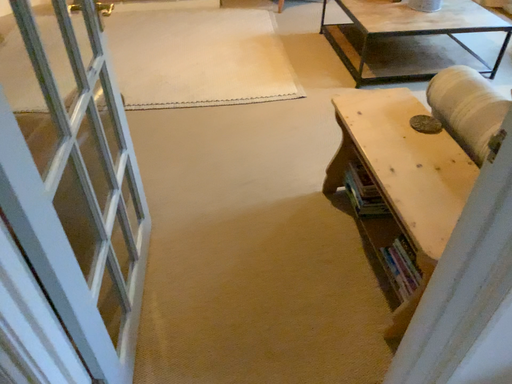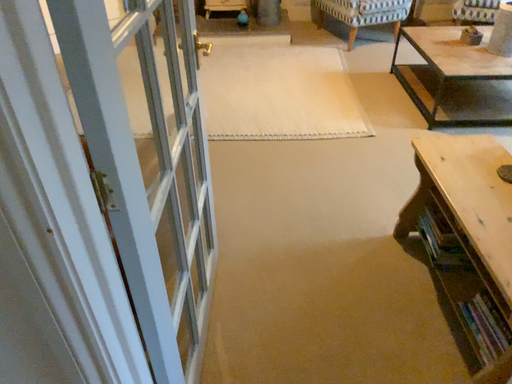
Question: Which way did the camera rotate in the video?

Choices:
 (A) rotated left
 (B) rotated right

Answer: (A)